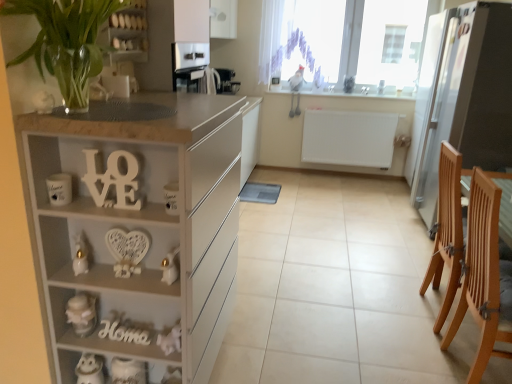
Question: Should I look upward or downward to see wooden sign at lower center, the second alphabet when ordered from top to bottom?

Choices:
 (A) up
 (B) down

Answer: (B)

Question: Is wooden sign at lower center, the second alphabet when ordered from top to bottom, next to white ceramic mug at left, marked as the 3th appliance in a top-to-bottom arrangement, and touching it?

Choices:
 (A) yes
 (B) no

Answer: (B)

Question: Does wooden sign at lower center, the 1th alphabet viewed from the back, turn towards white ceramic mug at left, marked as the 3th appliance in a top-to-bottom arrangement?

Choices:
 (A) no
 (B) yes

Answer: (A)

Question: Considering the relative sizes of wooden sign at lower center, the 1th alphabet viewed from the back, and white ceramic mug at left, which is the 1th appliance in front-to-back order, in the image provided, is wooden sign at lower center, the 1th alphabet viewed from the back, shorter than white ceramic mug at left, which is the 1th appliance in front-to-back order,?

Choices:
 (A) yes
 (B) no

Answer: (A)

Question: From the image's perspective, is wooden sign at lower center, which is the 2th alphabet from front to back, beneath white ceramic mug at left, the 3th appliance viewed from the right?

Choices:
 (A) no
 (B) yes

Answer: (B)

Question: Is wooden sign at lower center, which is the 2th alphabet from front to back, far from white ceramic mug at left, which is counted as the second appliance, starting from the bottom?

Choices:
 (A) yes
 (B) no

Answer: (B)

Question: Can you confirm if wooden sign at lower center, placed as the first alphabet when sorted from bottom to top, is positioned to the left of white ceramic mug at left, marked as the 4th appliance in a back-to-front arrangement?

Choices:
 (A) no
 (B) yes

Answer: (A)

Question: Is transparent glass window at upper center oriented towards white sheer curtain at upper center?

Choices:
 (A) no
 (B) yes

Answer: (B)

Question: Can you confirm if transparent glass window at upper center is taller than white sheer curtain at upper center?

Choices:
 (A) yes
 (B) no

Answer: (A)

Question: From the image's perspective, would you say transparent glass window at upper center is shown under white sheer curtain at upper center?

Choices:
 (A) no
 (B) yes

Answer: (A)

Question: Is transparent glass window at upper center in contact with white sheer curtain at upper center?

Choices:
 (A) yes
 (B) no

Answer: (A)

Question: Is transparent glass window at upper center thinner than white sheer curtain at upper center?

Choices:
 (A) yes
 (B) no

Answer: (A)

Question: Can you confirm if transparent glass window at upper center is positioned to the left of white sheer curtain at upper center?

Choices:
 (A) no
 (B) yes

Answer: (A)

Question: Are transparent glass window at upper center and white matte jar at lower left, which appears as the 3th toy when viewed from the right, far apart?

Choices:
 (A) no
 (B) yes

Answer: (B)